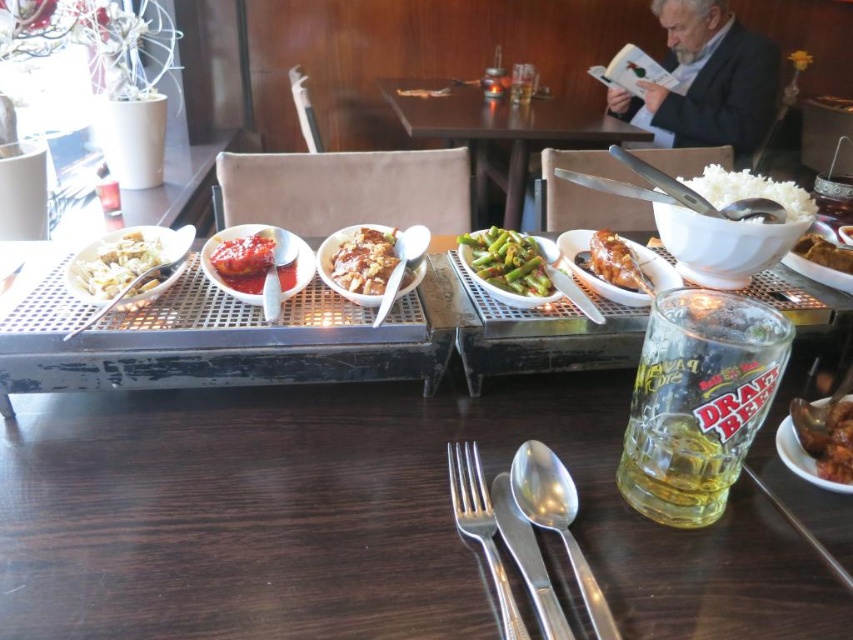
Question: Is the position of shiny brown chicken at center more distant than that of white plastic fork at center?

Choices:
 (A) yes
 (B) no

Answer: (A)

Question: Which point is farther from the camera taking this photo?

Choices:
 (A) (492, 580)
 (B) (491, 228)
 (C) (701, 193)
 (D) (715, 467)

Answer: (B)

Question: Which of these objects is positioned closest to the brushed metal spoon at left?

Choices:
 (A) satin silver spoon at lower center
 (B) translucent glass beer at center
 (C) clear glass beer at center
 (D) white plastic fork at center

Answer: (A)

Question: Is silver metallic spoon at lower center smaller than shiny brown chicken at center?

Choices:
 (A) yes
 (B) no

Answer: (A)

Question: Which of the following is the farthest from the observer?

Choices:
 (A) (689, 420)
 (B) (178, 257)
 (C) (492, 269)

Answer: (C)

Question: Is silver metallic spoon at lower center bigger than satin silver spoon at lower center?

Choices:
 (A) yes
 (B) no

Answer: (A)